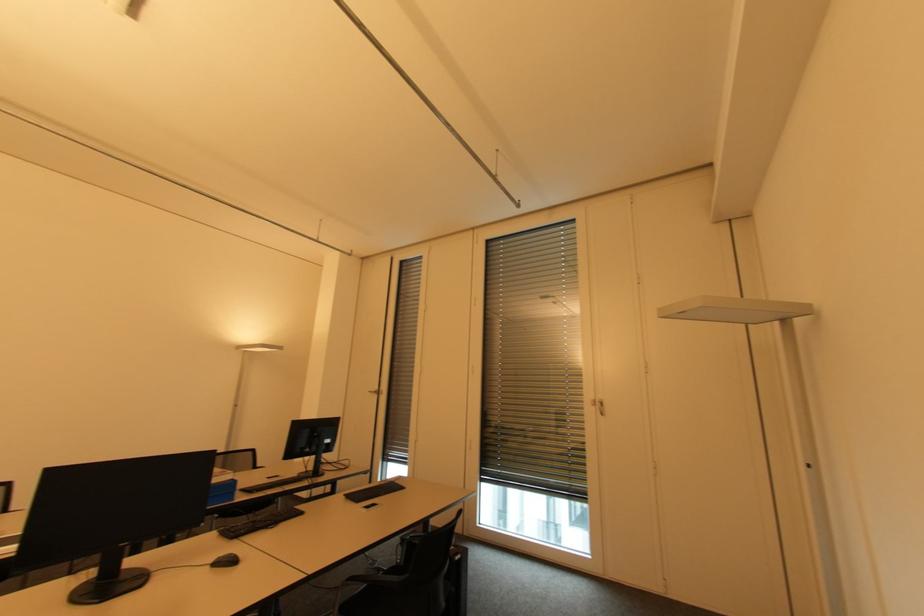
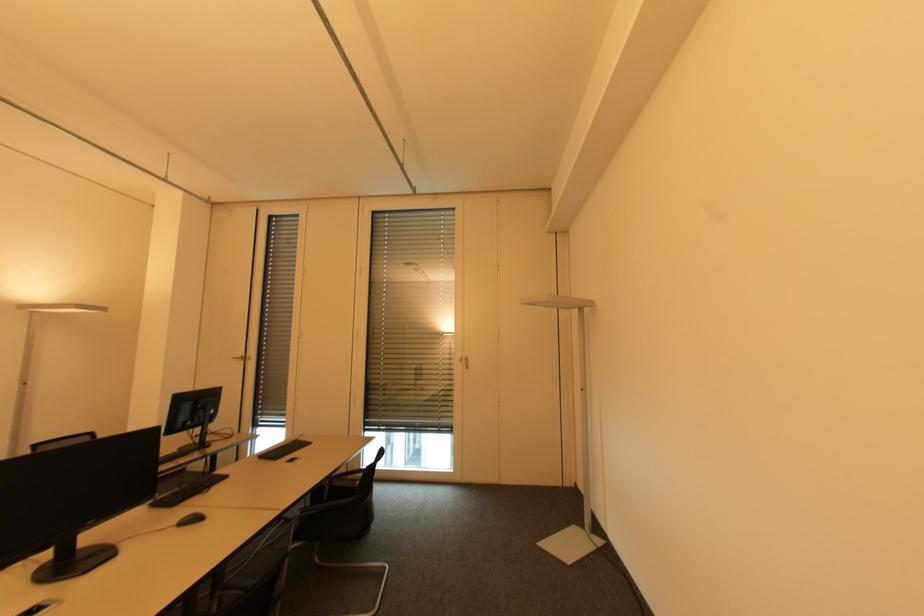
Question: How did the camera likely rotate?

Choices:
 (A) Left
 (B) Right
 (C) Up
 (D) Down

Answer: (B)